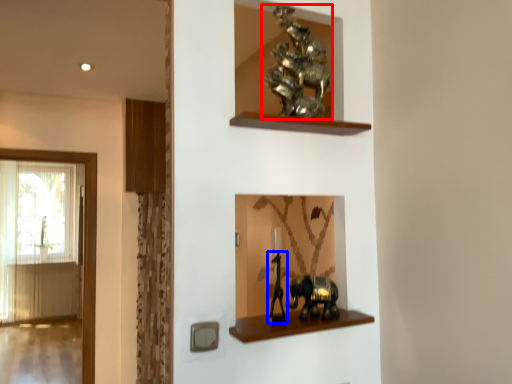
Question: Among these objects, which one is farthest to the camera, animal (highlighted by a red box) or animal (highlighted by a blue box)?

Choices:
 (A) animal
 (B) animal

Answer: (A)